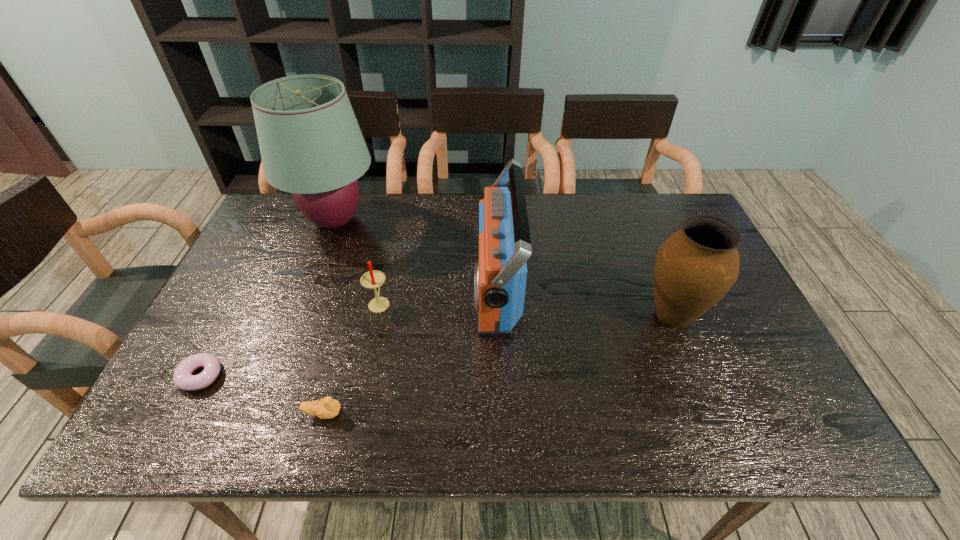
This screenshot has width=960, height=540. What are the coordinates of `unoccupied position between the shortest object and the third shortest object` in the screenshot? It's located at (290, 339).

You are a GUI agent. You are given a task and a screenshot of the screen. Output one action in this format:
    pyautogui.click(x=<x>, y=<y>)
    Task: Click on the free space between the lampshade and the radio receiver
    The width and height of the screenshot is (960, 540).
    Given the screenshot: What is the action you would take?
    pyautogui.click(x=416, y=255)

This screenshot has height=540, width=960. I want to click on vacant area that lies between the candle and the fifth object from left to right, so click(x=438, y=296).

Image resolution: width=960 pixels, height=540 pixels. Identify the location of free spot between the urn and the second object from right to left. (585, 302).

Image resolution: width=960 pixels, height=540 pixels. In order to click on unoccupied area between the doughnut and the urn in this screenshot , I will do `click(437, 346)`.

Where is `free space that is in between the fifth object from left to right and the fourth tallest object`? The width and height of the screenshot is (960, 540). free space that is in between the fifth object from left to right and the fourth tallest object is located at coordinates (438, 296).

The height and width of the screenshot is (540, 960). I want to click on object that ranks as the second closest to the lampshade, so click(499, 276).

The height and width of the screenshot is (540, 960). Identify the location of object that can be found as the closest to the tallest object. (372, 279).

Image resolution: width=960 pixels, height=540 pixels. Identify the location of vacant space that satisfies the following two spatial constraints: 1. on the front-facing side of the second object from right to left; 2. on the left side of the urn. (497, 316).